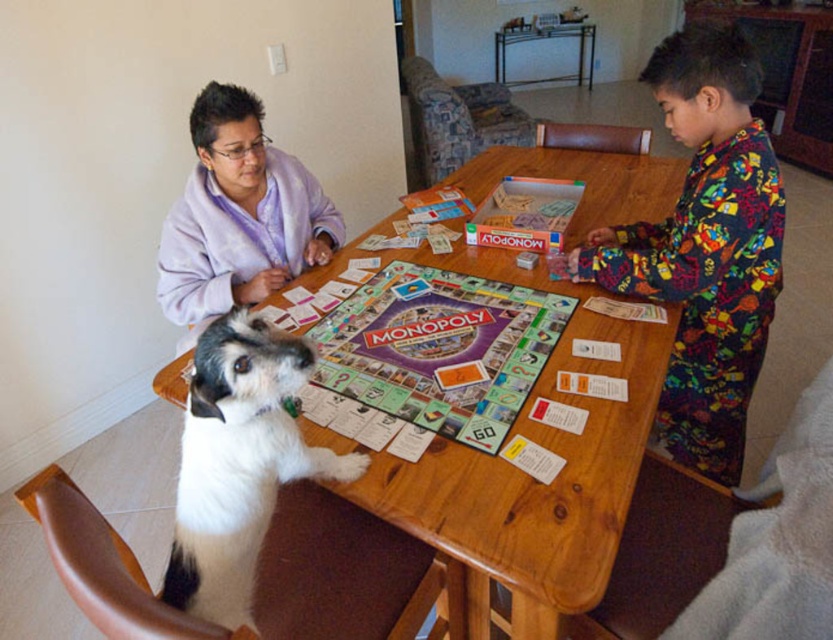
Question: Among these points, which one is nearest to the camera?

Choices:
 (A) (651, 333)
 (B) (247, 220)

Answer: (A)

Question: Is multicolored pajamas at right closer to camera compared to purple fleece at upper left?

Choices:
 (A) yes
 (B) no

Answer: (A)

Question: Is multicolored pajamas at right smaller than white fur dog at center?

Choices:
 (A) no
 (B) yes

Answer: (A)

Question: Which point appears closest to the camera in this image?

Choices:
 (A) (651, 342)
 (B) (302, 230)
 (C) (227, 422)

Answer: (C)

Question: Which is farther from the multicolored pajamas at right?

Choices:
 (A) purple fleece at upper left
 (B) white fur dog at center

Answer: (A)

Question: Is wooden table at center smaller than multicolored pajamas at right?

Choices:
 (A) yes
 (B) no

Answer: (B)